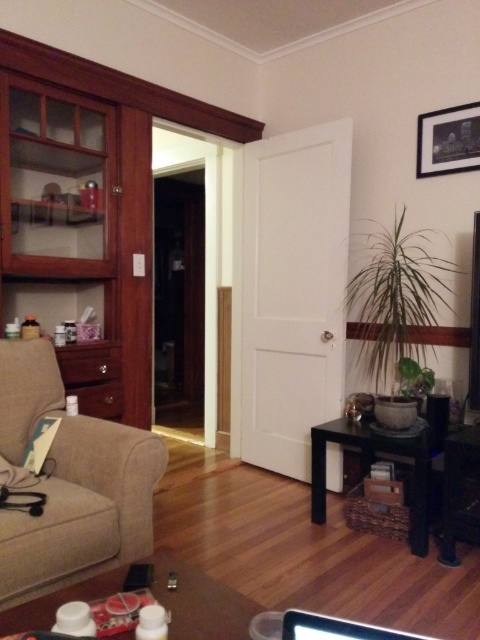
You are trying to place a new piece of furniture in the living room. The beige fabric armchair at left is currently occupying space. If you want to hang the matte black picture frame at upper right on the wall, will the armchair block the area where the frame will be placed?

The beige fabric armchair at left is wider than the matte black picture frame at upper right, so it might block the area where the frame will be placed on the wall.

Based on the photo, you are organizing a space in the living room and need to place a large decorative item. Which object, the black glossy cabinet at lower right or the matte black picture frame at upper right, would be more suitable for the item based on their sizes?

The black glossy cabinet at lower right is bigger than the matte black picture frame at upper right, so it would be more suitable for placing a large decorative item.

You are arranging a small plant that is 30 cm wide. You want to place it on the surface between the black glossy cabinet at lower right and the matte black picture frame at upper right. Can the plant fit between them?

The black glossy cabinet at lower right is wider than the matte black picture frame at upper right. Since the plant is 30 cm wide, it can fit between them as long as the available space between the two objects is at least 30 cm. However, the exact width of the space isn